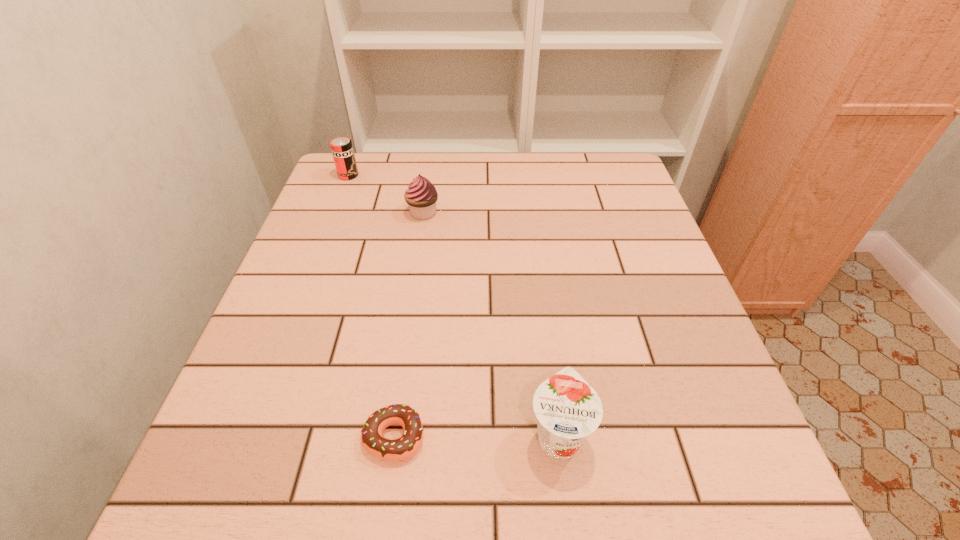
This screenshot has width=960, height=540. Identify the location of yogurt present at the near edge. (568, 409).

The width and height of the screenshot is (960, 540). I want to click on doughnut present at the near edge, so click(x=372, y=440).

The width and height of the screenshot is (960, 540). What are the coordinates of `object that is at the left edge` in the screenshot? It's located at (342, 150).

Image resolution: width=960 pixels, height=540 pixels. I want to click on object at the far left corner, so (342, 150).

The width and height of the screenshot is (960, 540). I want to click on vacant space at the far edge of the desktop, so click(502, 159).

Identify the location of blank area at the left edge. The image size is (960, 540). (241, 380).

I want to click on vacant space at the right edge of the desktop, so click(x=612, y=201).

Locate an element on the screen. vacant region at the far right corner is located at coordinates (593, 165).

At what (x,y) coordinates should I click in order to perform the action: click on empty space that is in between the third nearest object and the shortest object. Please return your answer as a coordinate pair (x, y). Looking at the image, I should click on (409, 325).

Image resolution: width=960 pixels, height=540 pixels. In order to click on unoccupied position between the yogurt and the doughnut in this screenshot , I will do 476,436.